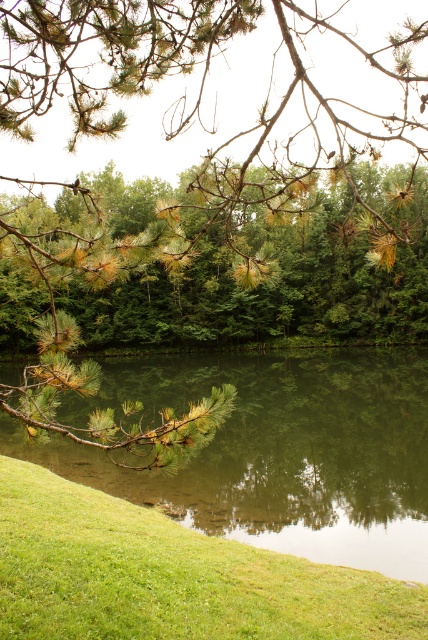
Is green reflective water at lower center thinner than green grassy at lower left?

No, green reflective water at lower center is not thinner than green grassy at lower left.

Is green reflective water at lower center in front of green grassy at lower left?

That is True.

Who is more forward, (183, 513) or (5, 580)?

Point (5, 580) is more forward.

Identify the location of green reflective water at lower center. (278, 451).

Is green needle-like at center bigger than green grassy at lower left?

Correct, green needle-like at center is larger in size than green grassy at lower left.

What are the coordinates of `green needle-like at center` in the screenshot? It's located at (240, 264).

Is the position of green matte pine branch at upper center more distant than that of green reflective water at lower center?

No, it is in front of green reflective water at lower center.

Does green matte pine branch at upper center appear under green reflective water at lower center?

Incorrect, green matte pine branch at upper center is not positioned below green reflective water at lower center.

Is point (315, 260) closer to viewer compared to point (374, 506)?

No.

Locate an element on the screen. The width and height of the screenshot is (428, 640). green matte pine branch at upper center is located at coordinates (204, 204).